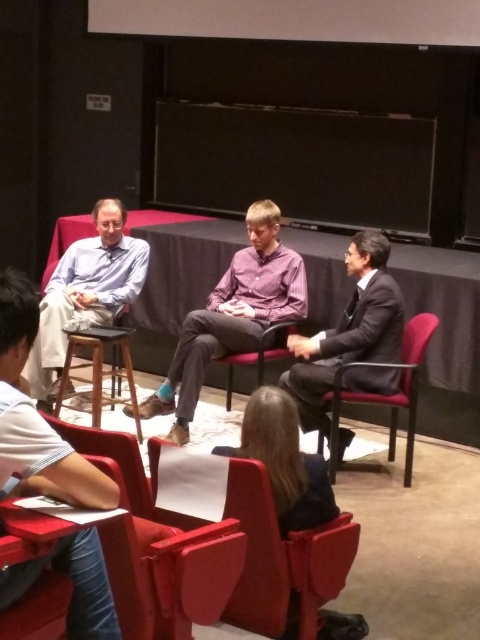
Does dark gray suit at center have a smaller size compared to smooth fabric chair at center?

No, dark gray suit at center is not smaller than smooth fabric chair at center.

Between point (338, 362) and point (227, 364), which one is positioned behind?

Positioned behind is point (227, 364).

Where is `dark gray suit at center`? dark gray suit at center is located at coordinates (348, 332).

Does smooth leather chair at lower center have a larger size compared to matte blue shirt at left?

Incorrect, smooth leather chair at lower center is not larger than matte blue shirt at left.

Can you confirm if smooth leather chair at lower center is positioned to the right of matte blue shirt at left?

Indeed, smooth leather chair at lower center is positioned on the right side of matte blue shirt at left.

Which is in front, point (260, 484) or point (127, 294)?

Positioned in front is point (260, 484).

Where is `smooth leather chair at lower center`? smooth leather chair at lower center is located at coordinates (280, 557).

Which is in front, point (136, 291) or point (256, 378)?

Positioned in front is point (136, 291).

I want to click on matte blue shirt at left, so click(85, 291).

Is point (39, 312) closer to camera compared to point (280, 348)?

Yes, it is.

Image resolution: width=480 pixels, height=640 pixels. I want to click on matte blue shirt at left, so click(85, 291).